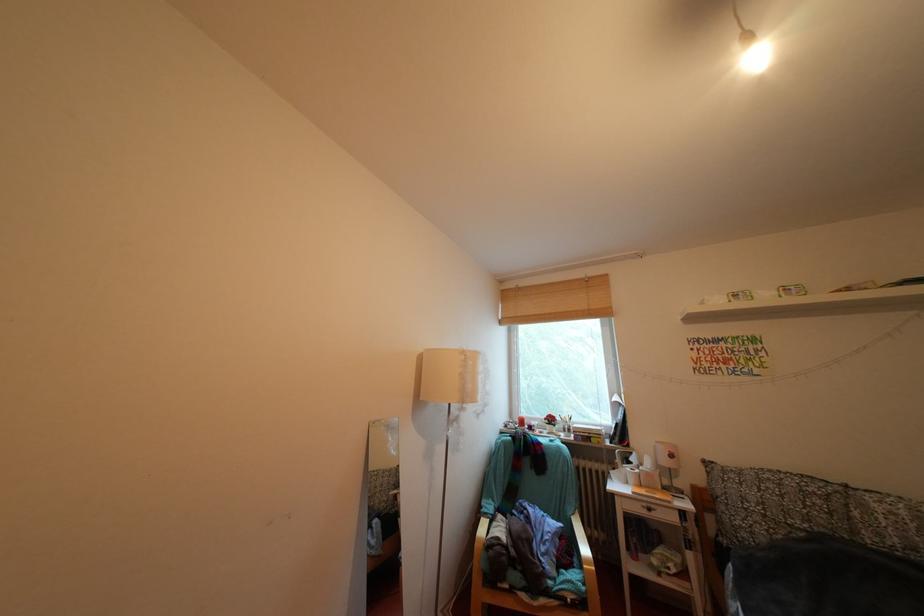
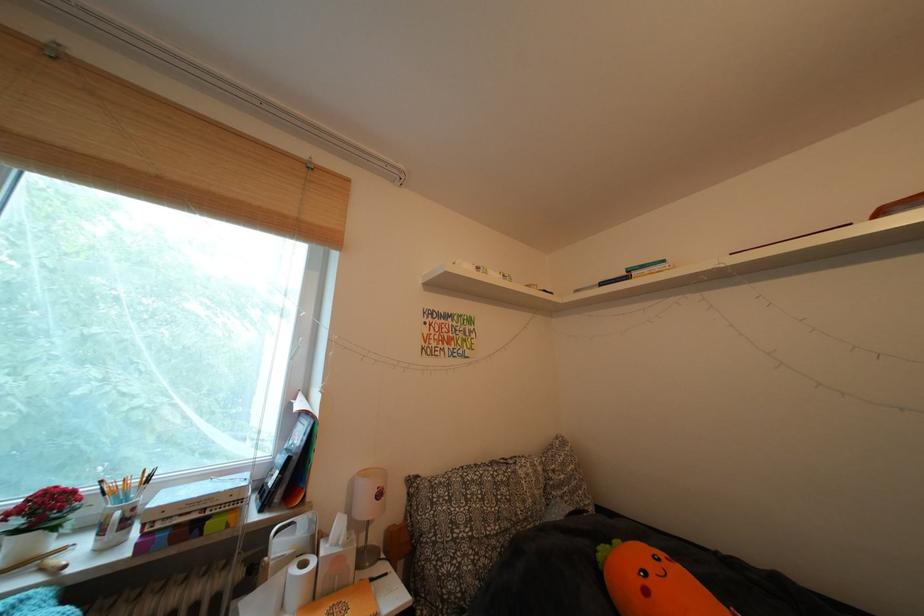
In the second image, find the point that corresponds to (x=675, y=466) in the first image.

(375, 513)